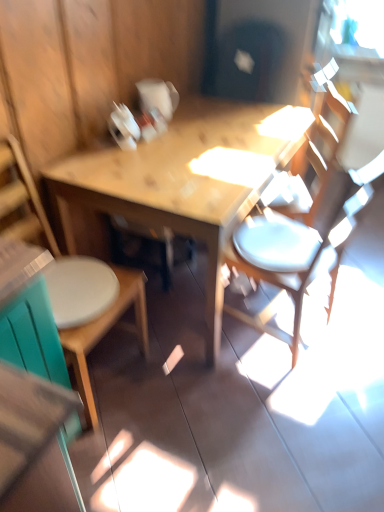
Where is `empty space that is to the right of wooden chair at left, which is counted as the first chair, starting from the left`? The height and width of the screenshot is (512, 384). empty space that is to the right of wooden chair at left, which is counted as the first chair, starting from the left is located at coordinates (173, 398).